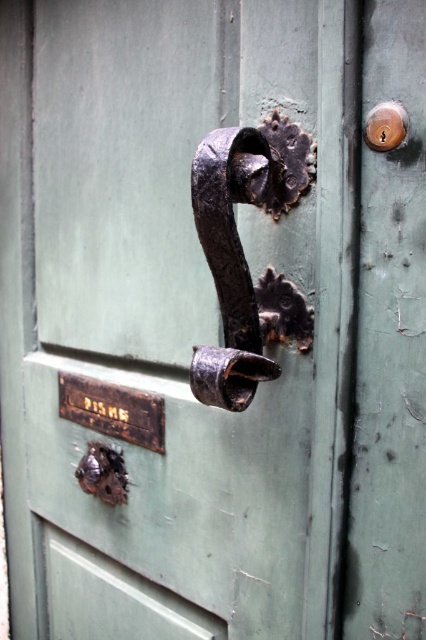
Based on the photo, you are a locksmith examining the green door. You need to determine which of the two rusty metal components, the rusty metal door handle at center or the rusty metal latch at lower left, requires immediate attention due to its height. Which one should you prioritize?

The rusty metal door handle at center is taller than the rusty metal latch at lower left, so you should prioritize the rusty metal door handle at center for immediate attention due to its height.

You are standing in front of the green door and want to open it. Which object, the rusty metal door handle at center or the rusty metal latch at lower left, should you interact with first?

You should interact with the rusty metal door handle at center first because it is closer to the viewer than the rusty metal latch at lower left.